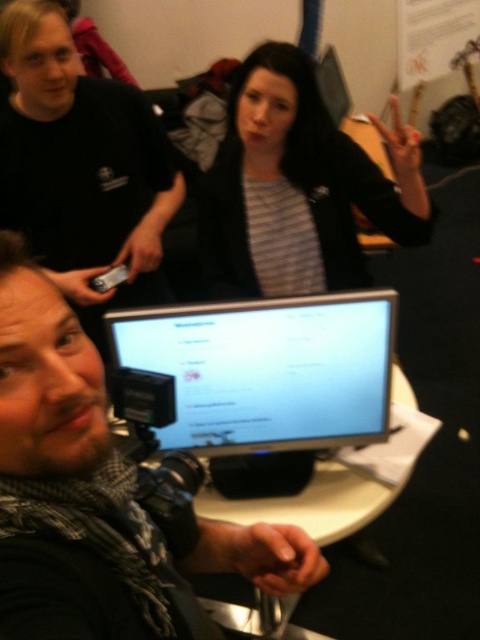
From the picture: You are setting up a photography studio and need to position your equipment. You have a matte black camera at lower left and a matte black monitor at center. According to the scene, which object is positioned to the left of the other?

The matte black camera at lower left is to the left of the matte black monitor at center.

You are organizing a photo shoot and need to ensure that the bearded man at center and the matte black camera at lower left fit within the frame. Based on their sizes, which object should be placed closer to the camera to maintain proper focus and framing?

The bearded man at center has a smaller width than the matte black camera at lower left, so to maintain proper focus and framing, the bearded man at center should be placed closer to the camera since smaller objects need to be nearer to fill the frame appropriately.

You are standing at the point marked by coordinates point (20, 580). You want to take a photo of the man with the camera. Can you reach the camera around his neck without moving from your current position?

The point marked by coordinates point (20, 580) is 19.02 inches away from the viewer. Since you are standing at that point, you are 19.02 inches away from the man with the camera. Whether you can reach the camera around his neck depends on your arm length, but the distance between you and him is 19.02 inches.